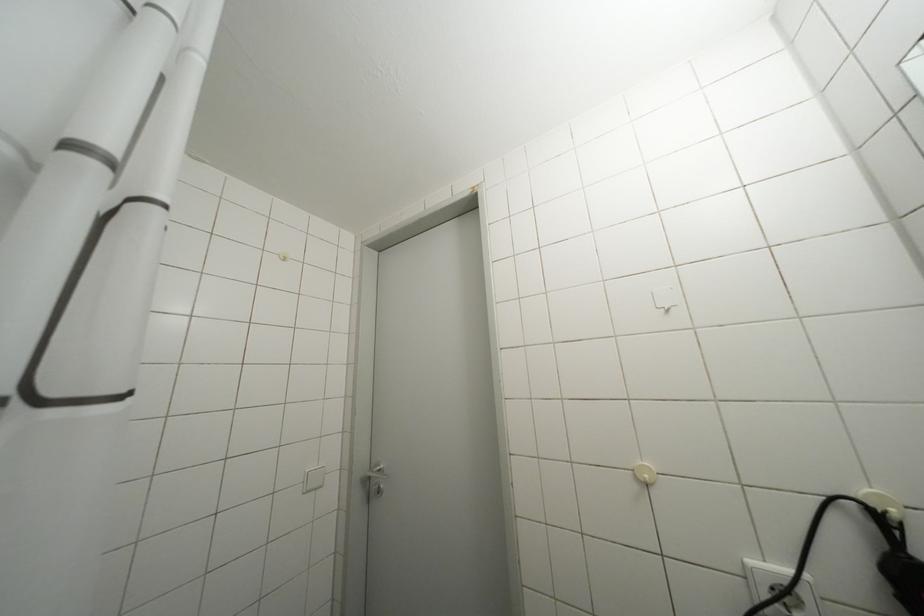
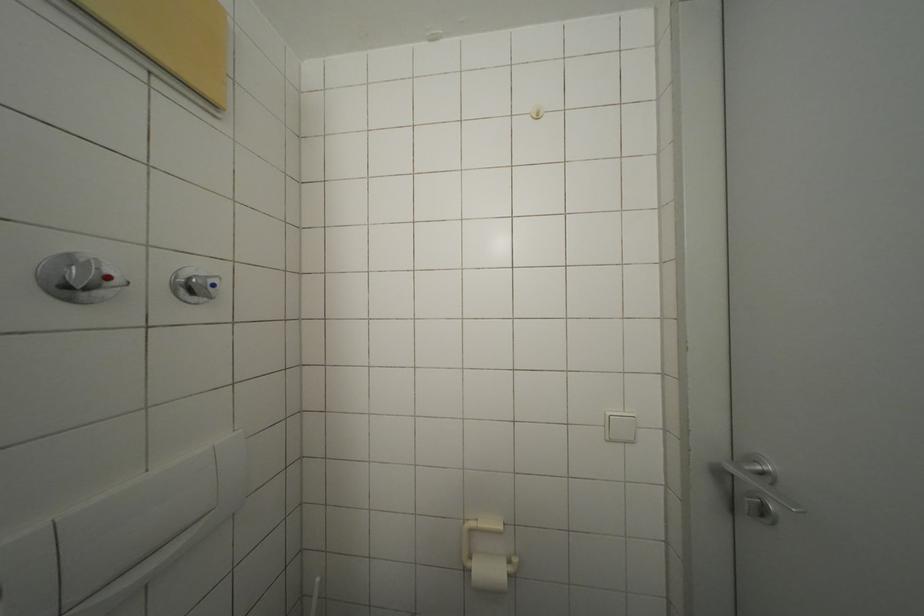
Question: The camera is either moving clockwise (left) or counter-clockwise (right) around the object. The first image is from the beginning of the video and the second image is from the end. Is the camera moving left or right when shooting the video?

Choices:
 (A) Left
 (B) Right

Answer: (B)